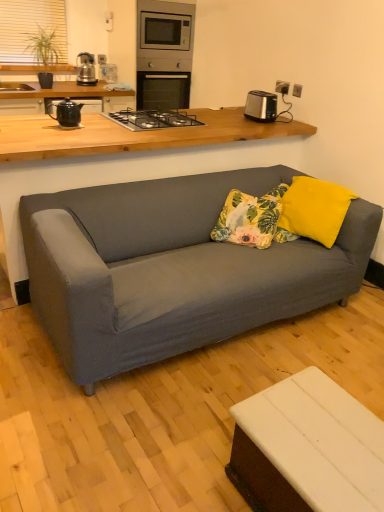
Question: From a real-world perspective, is white matte table at lower right, the 1th table when ordered from bottom to top, physically below satin silver toaster at upper right?

Choices:
 (A) no
 (B) yes

Answer: (B)

Question: Does white matte table at lower right, the 1th table when ordered from bottom to top, have a greater height compared to satin silver toaster at upper right?

Choices:
 (A) no
 (B) yes

Answer: (B)

Question: From a real-world perspective, is white matte table at lower right, the 1th table positioned from the front, physically above satin silver toaster at upper right?

Choices:
 (A) no
 (B) yes

Answer: (A)

Question: Can you confirm if white matte table at lower right, which ranks as the second table in back-to-front order, is positioned to the left of satin silver toaster at upper right?

Choices:
 (A) yes
 (B) no

Answer: (A)

Question: Can you confirm if white matte table at lower right, the 1th table when ordered from bottom to top, is bigger than satin silver toaster at upper right?

Choices:
 (A) no
 (B) yes

Answer: (B)

Question: From the image's perspective, is white matte table at lower right, the 1th table when ordered from bottom to top, beneath satin silver toaster at upper right?

Choices:
 (A) no
 (B) yes

Answer: (B)

Question: Is yellow fabric pillow at center in front of black ceramic teapot at left?

Choices:
 (A) no
 (B) yes

Answer: (B)

Question: Can you confirm if yellow fabric pillow at center is positioned to the left of black ceramic teapot at left?

Choices:
 (A) no
 (B) yes

Answer: (A)

Question: From the image's perspective, is yellow fabric pillow at center located above black ceramic teapot at left?

Choices:
 (A) no
 (B) yes

Answer: (A)

Question: From a real-world perspective, is yellow fabric pillow at center located higher than black ceramic teapot at left?

Choices:
 (A) yes
 (B) no

Answer: (B)

Question: Can you confirm if yellow fabric pillow at center is thinner than black ceramic teapot at left?

Choices:
 (A) yes
 (B) no

Answer: (B)

Question: Is yellow fabric pillow at center taller than black ceramic teapot at left?

Choices:
 (A) yes
 (B) no

Answer: (A)

Question: From the image's perspective, is matte gray couch at center, which is the second table in front-to-back order, located beneath beige fabric window screen at upper left?

Choices:
 (A) no
 (B) yes

Answer: (B)